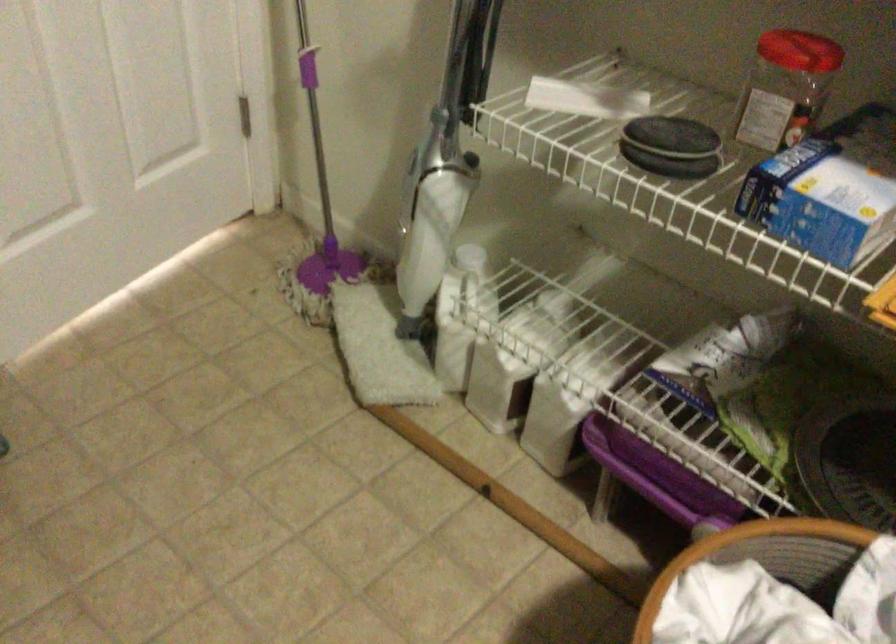
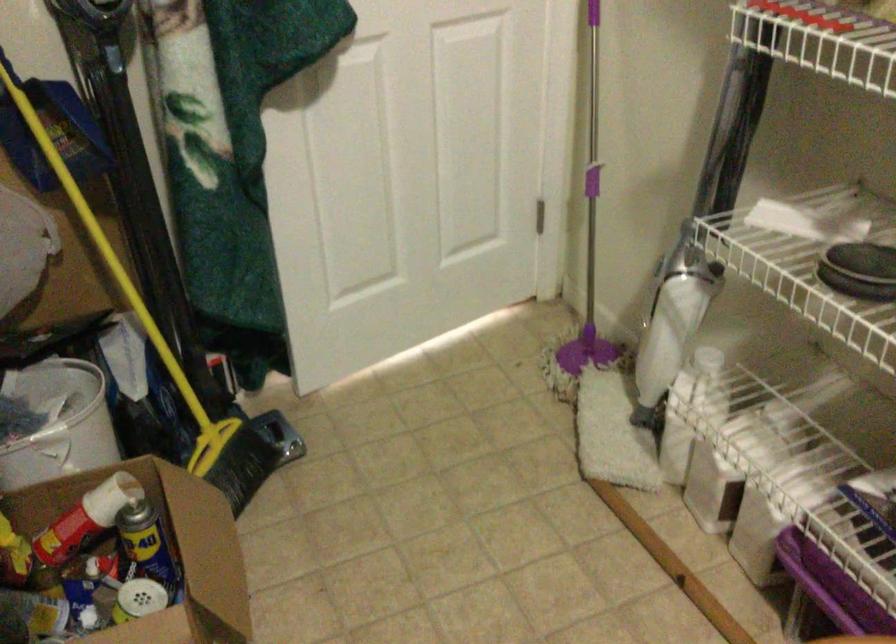
The images are taken continuously from a first-person perspective. In which direction are you moving?

The cameraman moved toward right, backward.